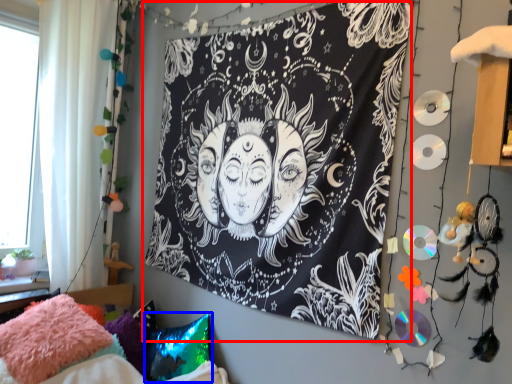
Question: Which point is further to the camera, bulletin board (highlighted by a red box) or pillow (highlighted by a blue box)?

Choices:
 (A) bulletin board
 (B) pillow

Answer: (B)